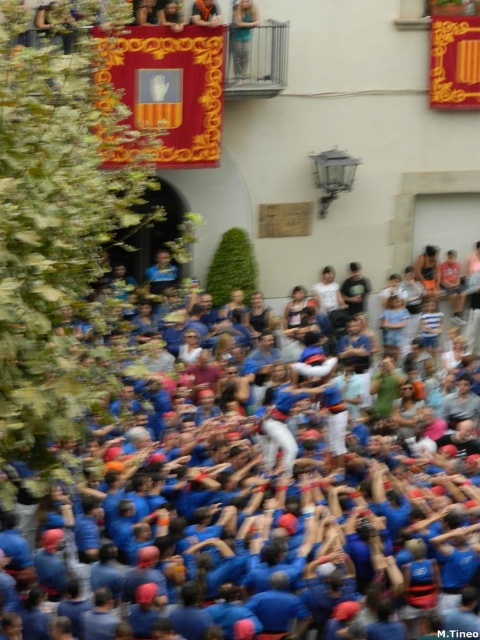
Looking at this image, can you confirm if blue fabric crowd at center is taller than light blue denim jeans at upper center?

Correct, blue fabric crowd at center is much taller as light blue denim jeans at upper center.

Does blue fabric crowd at center appear under light blue denim jeans at upper center?

Indeed, blue fabric crowd at center is positioned under light blue denim jeans at upper center.

Between point (141, 596) and point (245, 6), which one is positioned behind?

The point (245, 6) is behind.

In order to click on blue fabric crowd at center in this screenshot , I will do `click(252, 513)`.